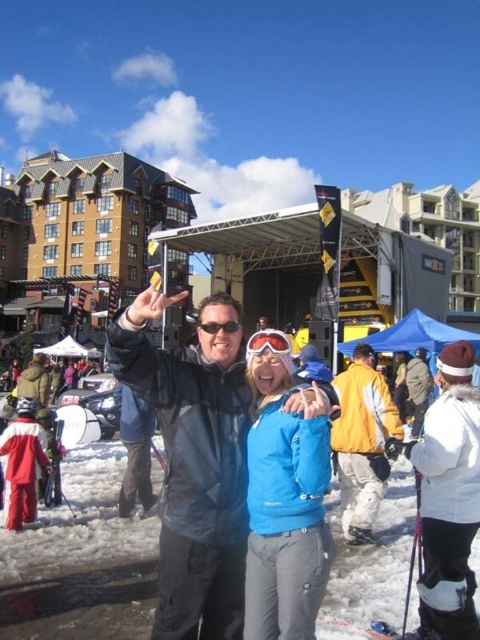
You are a photographer trying to capture a group photo of the two people wearing the matte black jacket at center and the yellow matte jacket at center. Your camera has a maximum focus range of 10 meters. Can you fit both subjects in the photo without moving either of them?

The matte black jacket at center and yellow matte jacket at center are 9.88 meters apart, which is within the camera maximum focus range of 10 meters. Therefore, you can fit both subjects in the photo without moving them.

You are a photographer setting up a shot of two people wearing jackets. The matte black jacket at center and the yellow matte jacket at center are in the frame. Based on their heights, which jacket should you focus on first if you want to ensure both are in focus?

The matte black jacket at center is taller than the yellow matte jacket at center, so focusing on the taller matte black jacket at center first would help ensure both are in focus since it is positioned further back.

You are a photographer trying to capture a photo of both the blue softshell jacket at center and the yellow matte jacket at center. Since you want to ensure both are visible, which jacket should be placed to the left to avoid blocking the other?

The blue softshell jacket at center should be placed to the left of the yellow matte jacket at center to avoid blocking it, as the blue softshell jacket at center is already positioned on the left side of the yellow matte jacket at center.